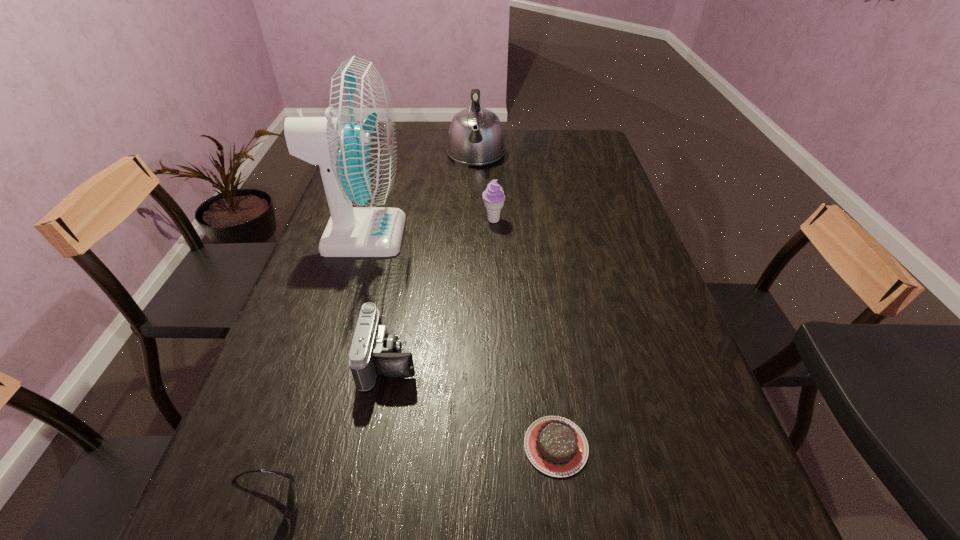
Locate an element on the screen. This screenshot has width=960, height=540. unoccupied position between the kettle and the third shortest object is located at coordinates (433, 258).

Locate an element on the screen. The height and width of the screenshot is (540, 960). vacant space that's between the tallest object and the icecream is located at coordinates (428, 228).

Find the location of `unoccupied area between the kettle and the third nearest object`. unoccupied area between the kettle and the third nearest object is located at coordinates (433, 258).

Identify the location of vacant space that's between the icecream and the chocolate cake. This screenshot has height=540, width=960. (524, 333).

Find the location of a particular element. The width and height of the screenshot is (960, 540). vacant area that lies between the fan and the fourth tallest object is located at coordinates (376, 298).

The width and height of the screenshot is (960, 540). I want to click on object that is the fifth closest to the shortest object, so click(475, 137).

Image resolution: width=960 pixels, height=540 pixels. Identify the location of object that is the closest one to the third tallest object. (355, 145).

I want to click on vacant space that satisfies the following two spatial constraints: 1. on the spout of the kettle; 2. on the left side of the icecream, so click(x=475, y=220).

This screenshot has width=960, height=540. In order to click on vacant position in the image that satisfies the following two spatial constraints: 1. at the front of the shortest object with an open lens cover; 2. on the right side of the fourth farthest object in this screenshot , I will do `click(374, 446)`.

Locate an element on the screen. Image resolution: width=960 pixels, height=540 pixels. blank area in the image that satisfies the following two spatial constraints: 1. on the spout of the farthest object; 2. in front of the fan to face the airflow is located at coordinates (475, 235).